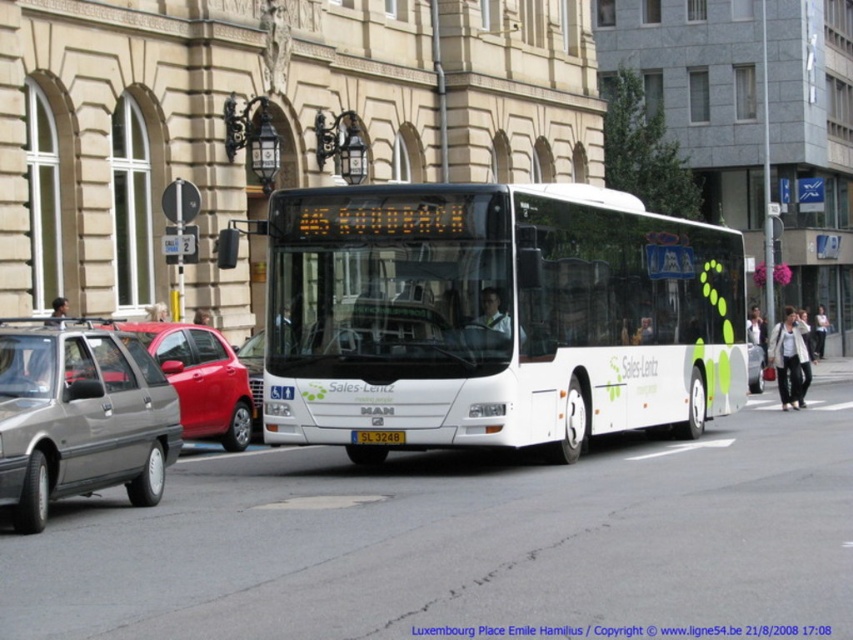
The width and height of the screenshot is (853, 640). What do you see at coordinates (200, 380) in the screenshot?
I see `metallic gray sedan at left` at bounding box center [200, 380].

Does metallic gray sedan at left come in front of yellow matte license plate at center?

No, it is behind yellow matte license plate at center.

What do you see at coordinates (200, 380) in the screenshot?
I see `metallic gray sedan at left` at bounding box center [200, 380].

Where is `metallic gray sedan at left`? metallic gray sedan at left is located at coordinates (200, 380).

Is white glossy bus at center above matte gray hatchback at left?

Indeed, white glossy bus at center is positioned over matte gray hatchback at left.

Who is positioned more to the right, white glossy bus at center or matte gray hatchback at left?

From the viewer's perspective, white glossy bus at center appears more on the right side.

Is point (409, 310) in front of point (76, 394)?

No, it is not.

At what (x,y) coordinates should I click in order to perform the action: click on white glossy bus at center. Please return your answer as a coordinate pair (x, y). This screenshot has height=640, width=853. Looking at the image, I should click on (495, 316).

Does white glossy bus at center have a greater height compared to metallic gray sedan at left?

Correct, white glossy bus at center is much taller as metallic gray sedan at left.

Is white glossy bus at center above metallic gray sedan at left?

Yes, white glossy bus at center is above metallic gray sedan at left.

Between point (376, 266) and point (144, 321), which one is positioned behind?

The point (144, 321) is behind.

This screenshot has height=640, width=853. In order to click on white glossy bus at center in this screenshot , I will do `click(495, 316)`.